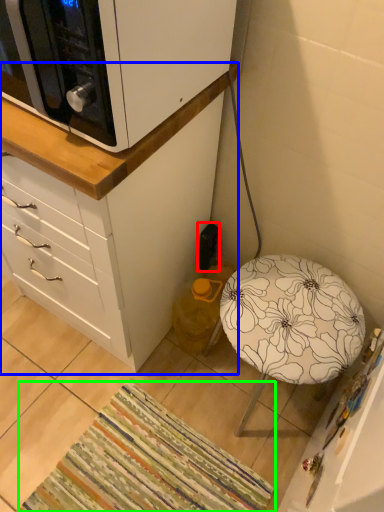
Question: Which is farther away from electric outlet (highlighted by a red box)? chest of drawers (highlighted by a blue box) or mat (highlighted by a green box)?

Choices:
 (A) chest of drawers
 (B) mat

Answer: (B)